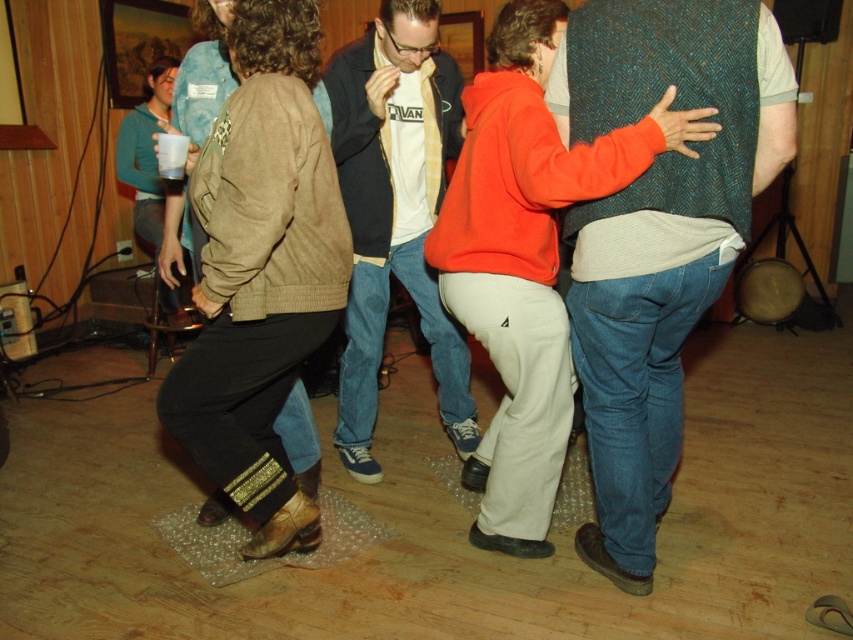
Is point (276, 112) positioned behind point (352, 432)?

That is False.

Is brown textured jacket at center closer to the viewer compared to matte white shirt at center?

Yes, brown textured jacket at center is closer to the viewer.

Image resolution: width=853 pixels, height=640 pixels. I want to click on brown textured jacket at center, so click(x=260, y=272).

Which of these two, green tweed vest at center or matte white shirt at center, stands taller?

matte white shirt at center

Measure the distance between green tweed vest at center and camera.

1.69 meters

Does point (601, 401) come in front of point (335, 116)?

Yes, point (601, 401) is in front of point (335, 116).

Locate an element on the screen. The image size is (853, 640). green tweed vest at center is located at coordinates (656, 237).

Is brown textured jacket at center behind orange fleece jacket at center?

Yes, brown textured jacket at center is further from the viewer.

In the scene shown: Which is more to the left, brown textured jacket at center or orange fleece jacket at center?

brown textured jacket at center

Does point (202, 262) come farther from viewer compared to point (541, 49)?

No, it is in front of (541, 49).

The image size is (853, 640). In order to click on brown textured jacket at center in this screenshot , I will do `click(260, 272)`.